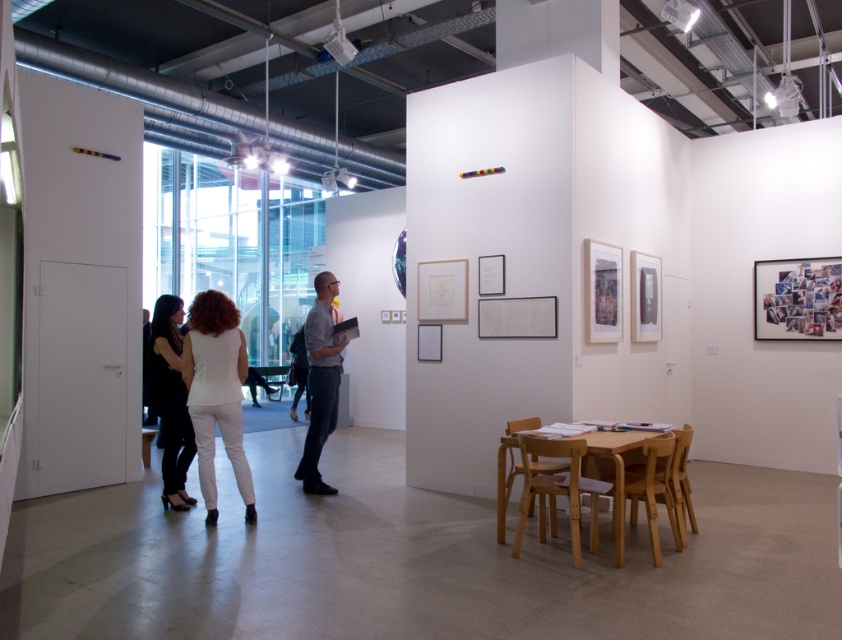
Question: In this image, where is white matte pants at lower center located relative to gray cotton shirt at center?

Choices:
 (A) right
 (B) left

Answer: (B)

Question: In this image, where is white matte pants at lower center located relative to black fabric dress at left?

Choices:
 (A) below
 (B) above

Answer: (B)

Question: Does black fabric dress at left come behind gray cotton shirt at center?

Choices:
 (A) no
 (B) yes

Answer: (A)

Question: Estimate the real-world distances between objects in this image. Which object is closer to the gray cotton shirt at center?

Choices:
 (A) white matte pants at lower center
 (B) black fabric dress at left

Answer: (A)

Question: Among these points, which one is nearest to the camera?

Choices:
 (A) (212, 364)
 (B) (184, 424)

Answer: (A)

Question: Which of the following is the farthest from the observer?

Choices:
 (A) (173, 436)
 (B) (219, 428)

Answer: (A)